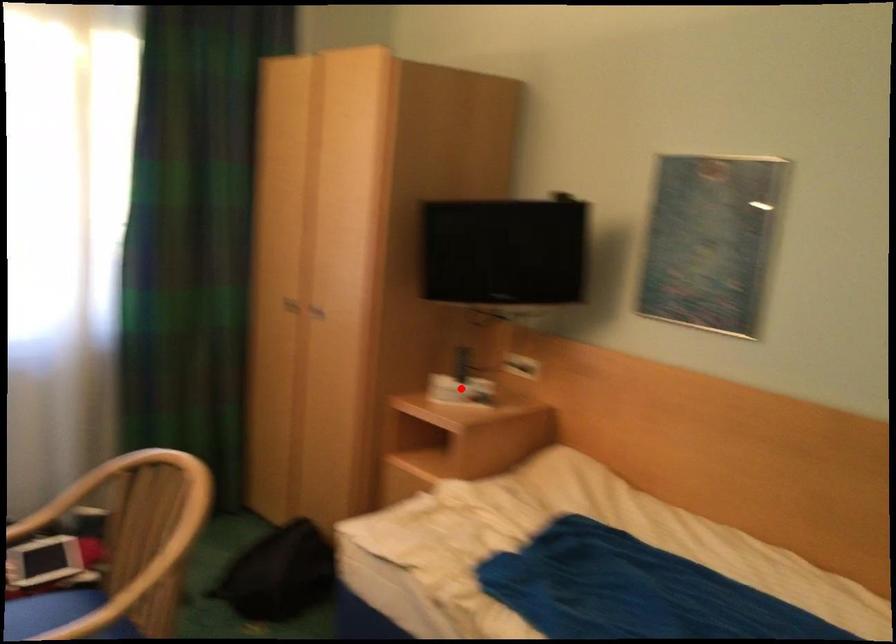
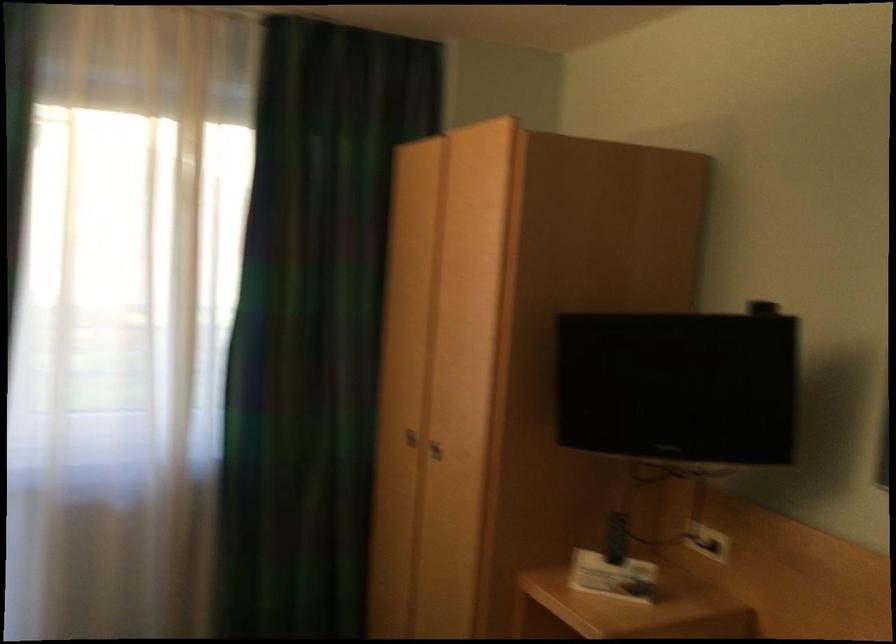
The point at the highlighted location is marked in the first image. Where is the corresponding point in the second image?

(613, 576)